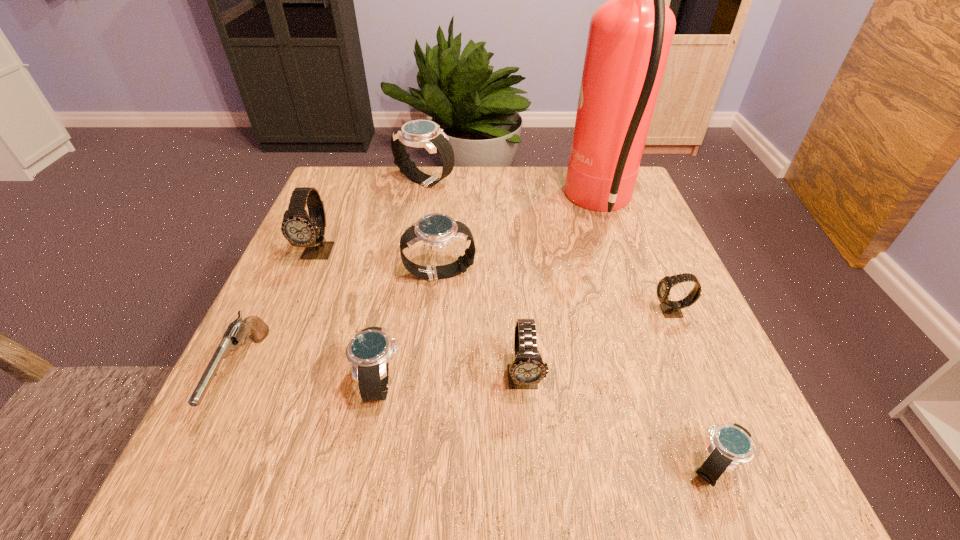
I want to click on object positioned at the near edge, so click(x=731, y=444).

Where is `watch at the left edge`? watch at the left edge is located at coordinates (300, 229).

What are the coordinates of `gun that is at the left edge` in the screenshot? It's located at (238, 330).

I want to click on fire extinguisher that is at the right edge, so click(629, 39).

Image resolution: width=960 pixels, height=540 pixels. I want to click on object located in the far right corner section of the desktop, so click(x=629, y=39).

Identify the location of object present at the near right corner. This screenshot has width=960, height=540. (731, 444).

At what (x,y) coordinates should I click in order to perform the action: click on blank area at the far edge. Please return your answer as a coordinate pair (x, y). Looking at the image, I should click on (471, 201).

Locate an element on the screen. The height and width of the screenshot is (540, 960). vacant point at the near edge is located at coordinates (499, 447).

Where is `vacant space at the left edge`? Image resolution: width=960 pixels, height=540 pixels. vacant space at the left edge is located at coordinates point(249,387).

In the image, there is a desktop. Where is `blank space at the right edge`? This screenshot has height=540, width=960. blank space at the right edge is located at coordinates (656, 228).